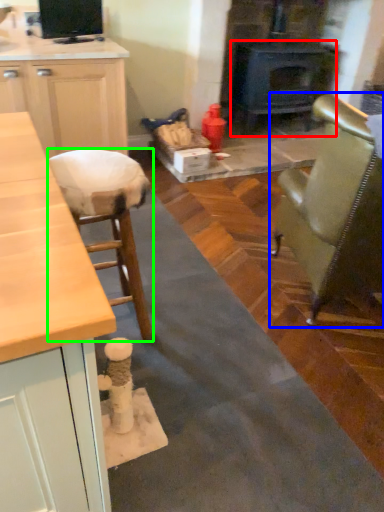
Question: Based on their relative distances, which object is farther from wood burning stove (highlighted by a red box)? Choose from chair (highlighted by a blue box) and stool (highlighted by a green box).

Choices:
 (A) chair
 (B) stool

Answer: (B)